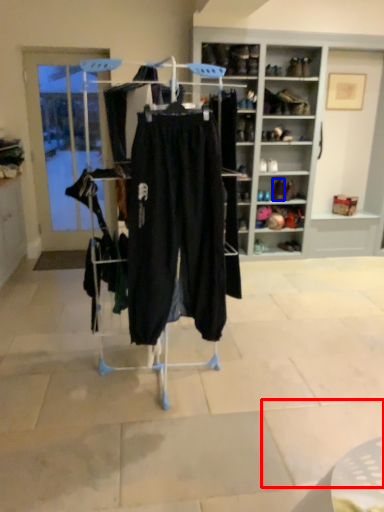
Question: Which of the following is the closest to the observer, tile (highlighted by a red box) or footwear (highlighted by a blue box)?

Choices:
 (A) tile
 (B) footwear

Answer: (A)